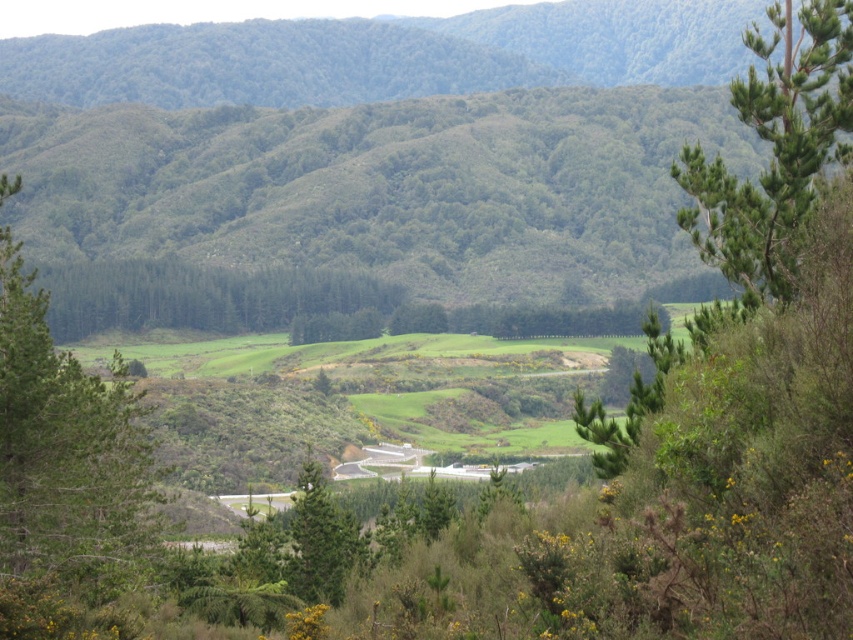
Does green leafy forest at center have a smaller size compared to green textured tree at center?

No.

The width and height of the screenshot is (853, 640). Find the location of `green leafy forest at center`. green leafy forest at center is located at coordinates (383, 186).

The image size is (853, 640). I want to click on green leafy forest at center, so click(x=383, y=186).

Can you confirm if green leafy forest at center is positioned to the right of green matte forest at center?

Yes, green leafy forest at center is to the right of green matte forest at center.

Between point (480, 260) and point (106, 324), which one is positioned behind?

The point (480, 260) is more distant.

Where is `green leafy forest at center`? The height and width of the screenshot is (640, 853). green leafy forest at center is located at coordinates (383, 186).

What do you see at coordinates (199, 296) in the screenshot? I see `green matte forest at center` at bounding box center [199, 296].

Which of these two, green matte forest at center or green textured tree at center, stands shorter?

green textured tree at center

Is point (386, 282) more distant than point (314, 536)?

Yes, point (386, 282) is farther from viewer.

Identify the location of green matte forest at center. (199, 296).